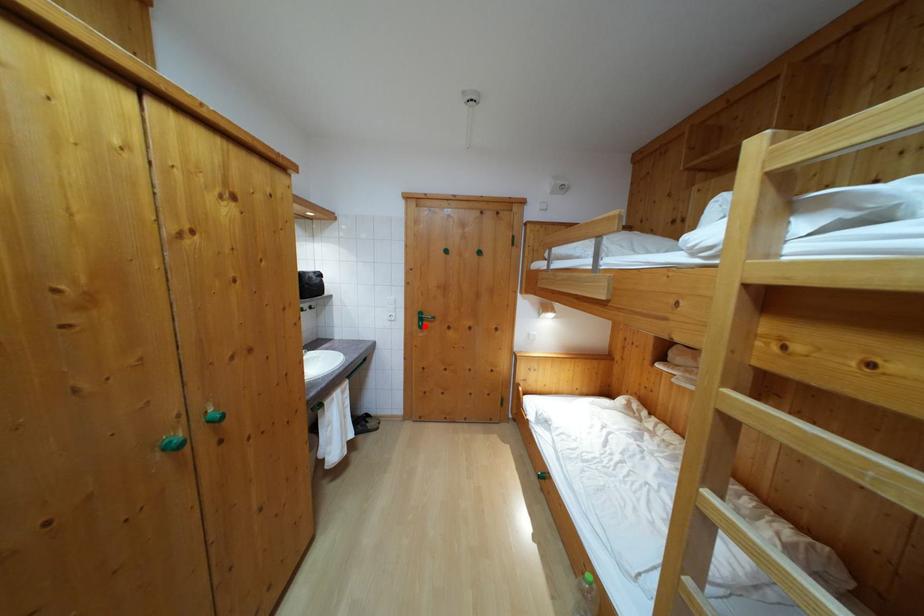
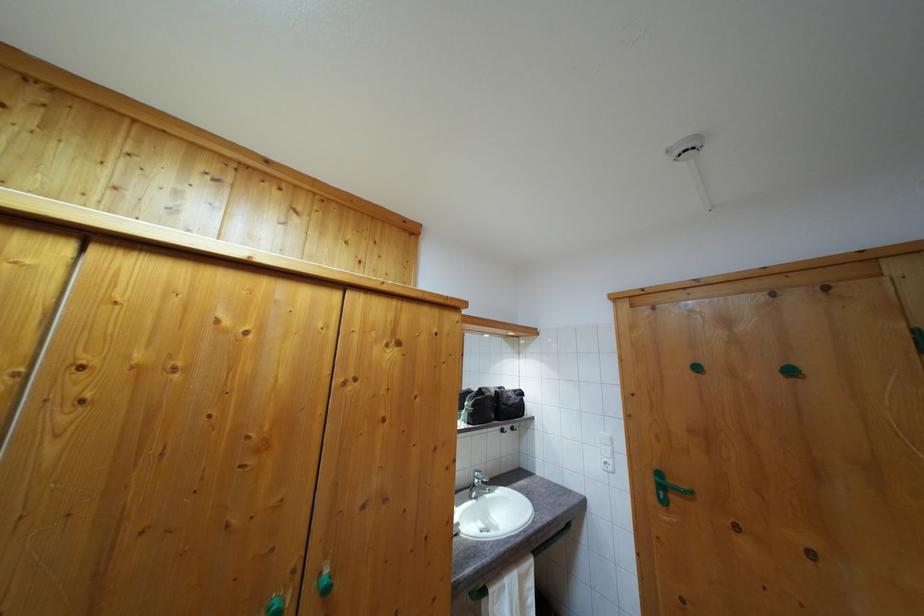
In the second image, find the point that corresponds to the highlighted location in the first image.

(664, 493)